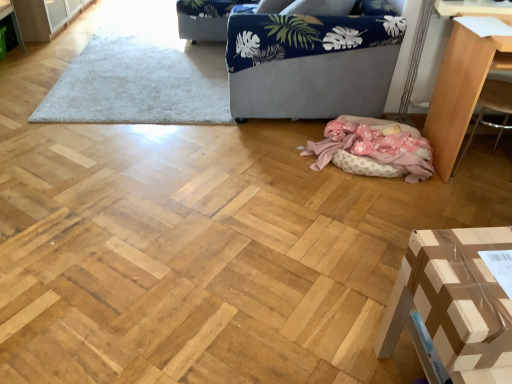
Where is `free point below white shaggy rug at upper center (from a real-world perspective)`? The height and width of the screenshot is (384, 512). free point below white shaggy rug at upper center (from a real-world perspective) is located at coordinates (144, 70).